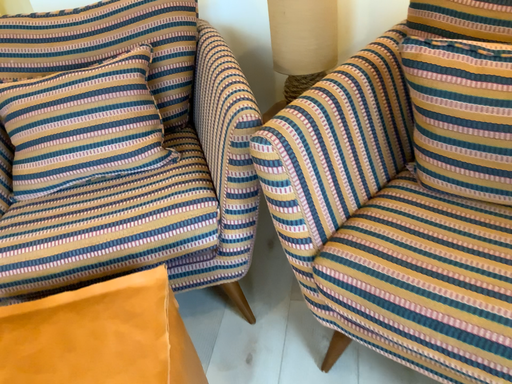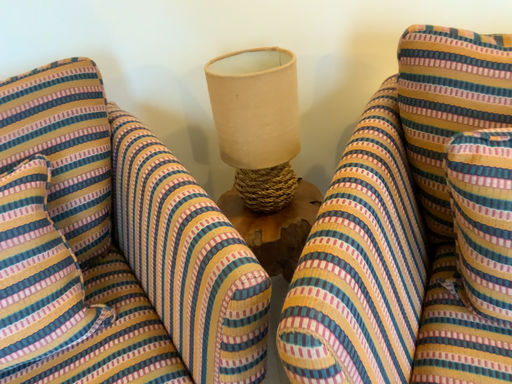
Question: Which way did the camera rotate in the video?

Choices:
 (A) rotated right
 (B) rotated left

Answer: (A)